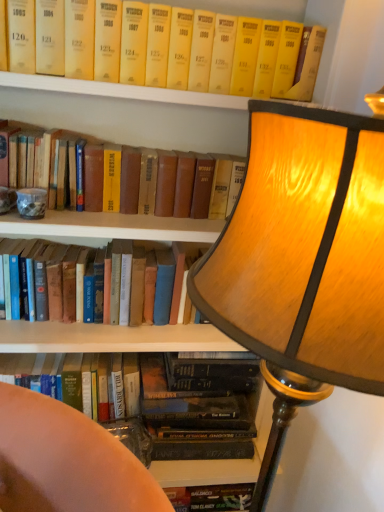
The height and width of the screenshot is (512, 384). What are the coordinates of `wooden lampshade at upper right` in the screenshot? It's located at (305, 248).

The image size is (384, 512). Describe the element at coordinates (92, 382) in the screenshot. I see `hardcover book at lower left, which is the 1th book in bottom-to-top order` at that location.

Describe the element at coordinates (92, 283) in the screenshot. I see `hardcover book at left, arranged as the second book when ordered from the bottom` at that location.

This screenshot has width=384, height=512. Describe the element at coordinates (116, 174) in the screenshot. I see `yellow hardcover book at upper center, marked as the 2th book in a top-to-bottom arrangement` at that location.

The height and width of the screenshot is (512, 384). What do you see at coordinates (164, 47) in the screenshot? I see `yellow paperback book at upper center, which appears as the 4th book when ordered from the bottom` at bounding box center [164, 47].

Find the location of a particular element. wooden lampshade at upper right is located at coordinates (305, 248).

Considering the positions of points (131, 64) and (81, 392), is point (131, 64) closer to camera compared to point (81, 392)?

Yes, it is.

Would you say hardcover book at lower left, which is the 1th book in bottom-to-top order, is part of yellow paperback book at upper center, the 1th book when ordered from top to bottom,'s contents?

Definitely not — hardcover book at lower left, which is the 1th book in bottom-to-top order, is not inside yellow paperback book at upper center, the 1th book when ordered from top to bottom.

Between yellow paperback book at upper center, the 1th book when ordered from top to bottom, and hardcover book at lower left, which is the 1th book in bottom-to-top order, which one has larger size?

With larger size is yellow paperback book at upper center, the 1th book when ordered from top to bottom.

Is point (238, 56) closer to viewer compared to point (243, 159)?

Yes, point (238, 56) is closer to viewer.

From the image's perspective, is yellow paperback book at upper center, the 1th book when ordered from top to bottom, over yellow hardcover book at upper center, marked as the 2th book in a top-to-bottom arrangement?

Yes, from the image's perspective, yellow paperback book at upper center, the 1th book when ordered from top to bottom, is on top of yellow hardcover book at upper center, marked as the 2th book in a top-to-bottom arrangement.

How different are the orientations of yellow paperback book at upper center, the 1th book when ordered from top to bottom, and yellow hardcover book at upper center, which appears as the 3th book when ordered from the bottom, in degrees?

The angle between the facing direction of yellow paperback book at upper center, the 1th book when ordered from top to bottom, and the facing direction of yellow hardcover book at upper center, which appears as the 3th book when ordered from the bottom, is 2.18 degrees.

I want to click on the 1st book positioned below the yellow paperback book at upper center, the 1th book when ordered from top to bottom (from a real-world perspective), so click(x=116, y=174).

In the scene shown: Is wooden lampshade at upper right far away from hardcover book at left, which is the third book in top-to-bottom order?

No.

From the picture: Does wooden lampshade at upper right have a smaller size compared to hardcover book at left, which is the third book in top-to-bottom order?

Actually, wooden lampshade at upper right might be larger than hardcover book at left, which is the third book in top-to-bottom order.

Is hardcover book at left, which is the third book in top-to-bottom order, surrounded by wooden lampshade at upper right?

No, hardcover book at left, which is the third book in top-to-bottom order, is not surrounded by wooden lampshade at upper right.

Is hardcover book at lower left, the fourth book when ordered from top to bottom, aimed at yellow hardcover book at upper center, marked as the 2th book in a top-to-bottom arrangement?

No, hardcover book at lower left, the fourth book when ordered from top to bottom, does not turn towards yellow hardcover book at upper center, marked as the 2th book in a top-to-bottom arrangement.

Which object is further away from the camera, hardcover book at lower left, which is the 1th book in bottom-to-top order, or yellow hardcover book at upper center, marked as the 2th book in a top-to-bottom arrangement?

hardcover book at lower left, which is the 1th book in bottom-to-top order, is more distant.

Is hardcover book at lower left, the fourth book when ordered from top to bottom, touching yellow hardcover book at upper center, which appears as the 3th book when ordered from the bottom?

No, hardcover book at lower left, the fourth book when ordered from top to bottom, is not touching yellow hardcover book at upper center, which appears as the 3th book when ordered from the bottom.

Is hardcover book at lower left, which is the 1th book in bottom-to-top order, located outside yellow hardcover book at upper center, marked as the 2th book in a top-to-bottom arrangement?

Yes, hardcover book at lower left, which is the 1th book in bottom-to-top order, is located beyond the bounds of yellow hardcover book at upper center, marked as the 2th book in a top-to-bottom arrangement.

Does hardcover book at lower left, the fourth book when ordered from top to bottom, have a smaller size compared to yellow paperback book at upper center, the 1th book when ordered from top to bottom?

Yes, hardcover book at lower left, the fourth book when ordered from top to bottom, is smaller than yellow paperback book at upper center, the 1th book when ordered from top to bottom.

How different are the orientations of hardcover book at lower left, which is the 1th book in bottom-to-top order, and yellow paperback book at upper center, which appears as the 4th book when ordered from the bottom, in degrees?

hardcover book at lower left, which is the 1th book in bottom-to-top order, and yellow paperback book at upper center, which appears as the 4th book when ordered from the bottom, are facing 3.06 degrees away from each other.

From a real-world perspective, is hardcover book at lower left, which is the 1th book in bottom-to-top order, physically below yellow paperback book at upper center, which appears as the 4th book when ordered from the bottom?

Yes.

Is hardcover book at lower left, the fourth book when ordered from top to bottom, oriented towards yellow paperback book at upper center, which appears as the 4th book when ordered from the bottom?

No, hardcover book at lower left, the fourth book when ordered from top to bottom, is not aimed at yellow paperback book at upper center, which appears as the 4th book when ordered from the bottom.

Which of these two, hardcover book at lower left, the fourth book when ordered from top to bottom, or hardcover book at left, arranged as the second book when ordered from the bottom, is wider?

Wider between the two is hardcover book at lower left, the fourth book when ordered from top to bottom.

Looking at the image, does hardcover book at lower left, which is the 1th book in bottom-to-top order, seem bigger or smaller compared to hardcover book at left, arranged as the second book when ordered from the bottom?

Considering their sizes, hardcover book at lower left, which is the 1th book in bottom-to-top order, takes up less space than hardcover book at left, arranged as the second book when ordered from the bottom.

Image resolution: width=384 pixels, height=512 pixels. What are the coordinates of `the 1st book above the hardcover book at lower left, the fourth book when ordered from top to bottom (from the image's perspective)` in the screenshot? It's located at (92, 283).

Is yellow hardcover book at upper center, marked as the 2th book in a top-to-bottom arrangement, aimed at yellow paperback book at upper center, which appears as the 4th book when ordered from the bottom?

No, yellow hardcover book at upper center, marked as the 2th book in a top-to-bottom arrangement, is not turned towards yellow paperback book at upper center, which appears as the 4th book when ordered from the bottom.

Which object is closer to the camera taking this photo, yellow hardcover book at upper center, which appears as the 3th book when ordered from the bottom, or yellow paperback book at upper center, the 1th book when ordered from top to bottom?

yellow paperback book at upper center, the 1th book when ordered from top to bottom, is more forward.

Considering the sizes of yellow hardcover book at upper center, marked as the 2th book in a top-to-bottom arrangement, and yellow paperback book at upper center, the 1th book when ordered from top to bottom, in the image, is yellow hardcover book at upper center, marked as the 2th book in a top-to-bottom arrangement, wider or thinner than yellow paperback book at upper center, the 1th book when ordered from top to bottom,?

Clearly, yellow hardcover book at upper center, marked as the 2th book in a top-to-bottom arrangement, has less width compared to yellow paperback book at upper center, the 1th book when ordered from top to bottom.

Considering the relative sizes of yellow hardcover book at upper center, which appears as the 3th book when ordered from the bottom, and yellow paperback book at upper center, which appears as the 4th book when ordered from the bottom, in the image provided, is yellow hardcover book at upper center, which appears as the 3th book when ordered from the bottom, taller than yellow paperback book at upper center, which appears as the 4th book when ordered from the bottom,?

Yes, yellow hardcover book at upper center, which appears as the 3th book when ordered from the bottom, is taller than yellow paperback book at upper center, which appears as the 4th book when ordered from the bottom.

From a real-world perspective, starting from the yellow paperback book at upper center, which appears as the 4th book when ordered from the bottom, which book is the 3rd one below it? Please provide its 2D coordinates.

[(92, 382)]

This screenshot has height=512, width=384. I want to click on book that appears on the right of yellow hardcover book at upper center, marked as the 2th book in a top-to-bottom arrangement, so click(x=164, y=47).

Looking at the image, which one is located further to hardcover book at lower left, the fourth book when ordered from top to bottom, wooden lampshade at upper right or yellow paperback book at upper center, the 1th book when ordered from top to bottom?

Based on the image, yellow paperback book at upper center, the 1th book when ordered from top to bottom, appears to be further to hardcover book at lower left, the fourth book when ordered from top to bottom.

Looking at the image, which one is located further to hardcover book at left, which is the third book in top-to-bottom order, wooden lampshade at upper right or yellow paperback book at upper center, which appears as the 4th book when ordered from the bottom?

wooden lampshade at upper right lies further to hardcover book at left, which is the third book in top-to-bottom order, than the other object.

Consider the image. From the image, which object appears to be farther from wooden lampshade at upper right, hardcover book at left, which is the third book in top-to-bottom order, or hardcover book at lower left, which is the 1th book in bottom-to-top order?

The object further to wooden lampshade at upper right is hardcover book at lower left, which is the 1th book in bottom-to-top order.

When comparing their distances from yellow hardcover book at upper center, which appears as the 3th book when ordered from the bottom, does wooden lampshade at upper right or hardcover book at lower left, the fourth book when ordered from top to bottom, seem further?

wooden lampshade at upper right lies further to yellow hardcover book at upper center, which appears as the 3th book when ordered from the bottom, than the other object.

From the image, which object appears to be nearer to hardcover book at left, which is the third book in top-to-bottom order, yellow paperback book at upper center, which appears as the 4th book when ordered from the bottom, or hardcover book at lower left, the fourth book when ordered from top to bottom?

The object closer to hardcover book at left, which is the third book in top-to-bottom order, is hardcover book at lower left, the fourth book when ordered from top to bottom.

Which object lies nearer to the anchor point hardcover book at left, arranged as the second book when ordered from the bottom, yellow paperback book at upper center, which appears as the 4th book when ordered from the bottom, or wooden lampshade at upper right?

yellow paperback book at upper center, which appears as the 4th book when ordered from the bottom, lies closer to hardcover book at left, arranged as the second book when ordered from the bottom, than the other object.

In the scene shown: From the image, which object appears to be farther from hardcover book at lower left, which is the 1th book in bottom-to-top order, yellow paperback book at upper center, which appears as the 4th book when ordered from the bottom, or wooden lampshade at upper right?

Based on the image, yellow paperback book at upper center, which appears as the 4th book when ordered from the bottom, appears to be further to hardcover book at lower left, which is the 1th book in bottom-to-top order.

Based on the photo, based on their spatial positions, is yellow paperback book at upper center, the 1th book when ordered from top to bottom, or hardcover book at lower left, which is the 1th book in bottom-to-top order, further from wooden lampshade at upper right?

hardcover book at lower left, which is the 1th book in bottom-to-top order, is positioned further to the anchor wooden lampshade at upper right.

The width and height of the screenshot is (384, 512). What are the coordinates of `book between wooden lampshade at upper right and yellow hardcover book at upper center, which appears as the 3th book when ordered from the bottom, from front to back` in the screenshot? It's located at (164, 47).

Locate an element on the screen. The width and height of the screenshot is (384, 512). book between yellow hardcover book at upper center, marked as the 2th book in a top-to-bottom arrangement, and hardcover book at lower left, the fourth book when ordered from top to bottom, from top to bottom is located at coordinates (92, 283).

What are the coordinates of `book between yellow paperback book at upper center, the 1th book when ordered from top to bottom, and hardcover book at left, arranged as the second book when ordered from the bottom, in the vertical direction` in the screenshot? It's located at (116, 174).